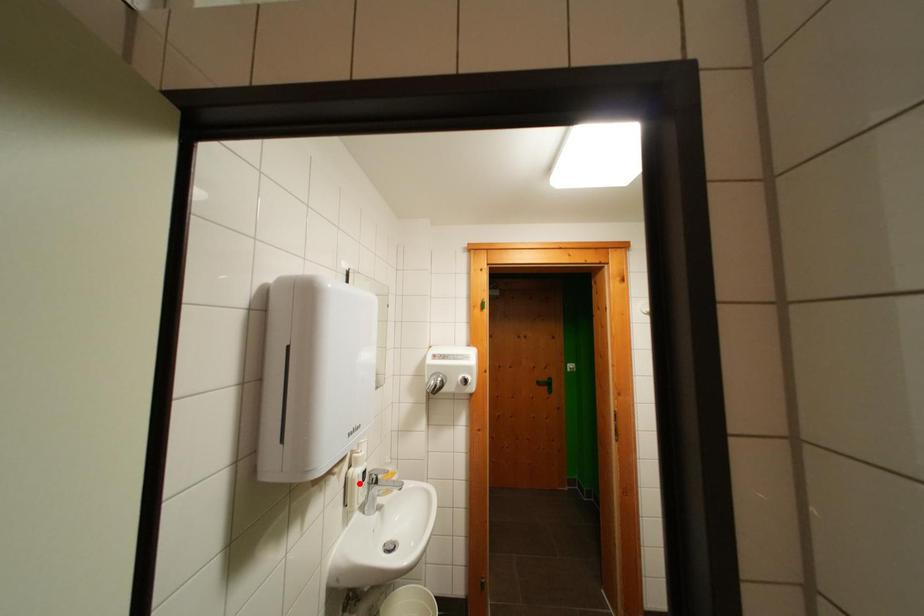
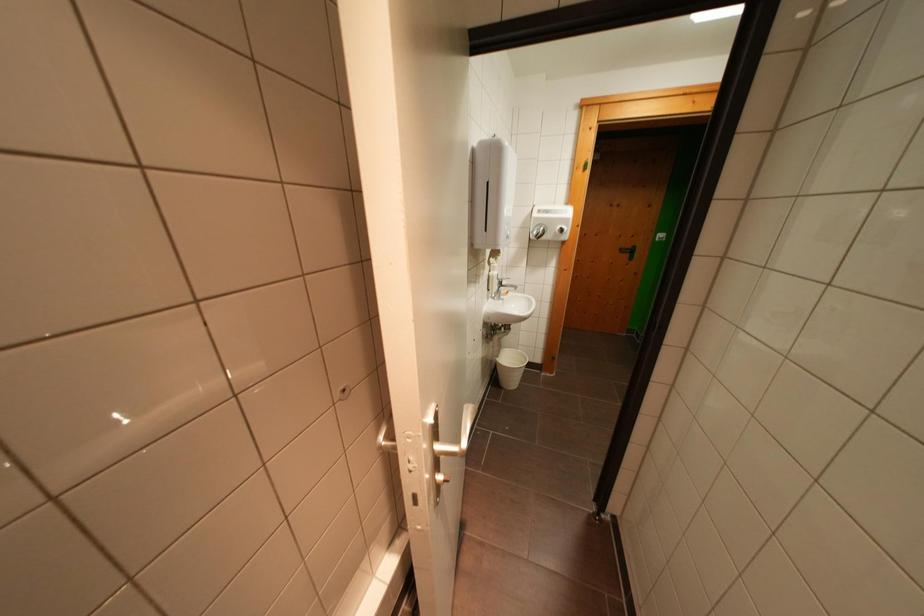
Question: I am providing you with two images of the same scene from different viewpoints. A red point is shown in image1. For the corresponding object point in image2, is it positioned nearer or farther from the camera?

Choices:
 (A) Nearer
 (B) Farther

Answer: (A)